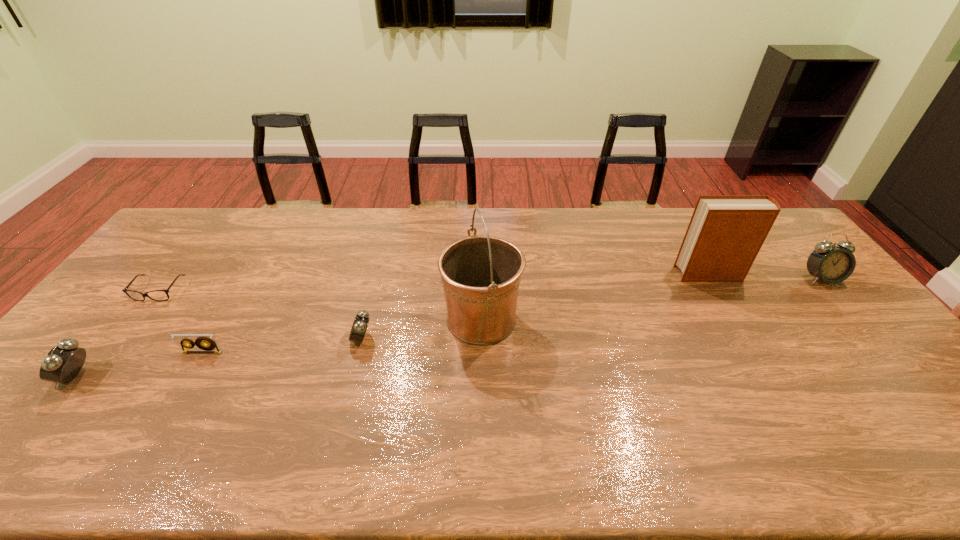
At what (x,y) coordinates should I click in order to perform the action: click on free region located 0.340m on the open cover of the sixth shortest object. Please return your answer as a coordinate pair (x, y). The height and width of the screenshot is (540, 960). Looking at the image, I should click on (571, 274).

This screenshot has width=960, height=540. I want to click on free space located on the open cover of the sixth shortest object, so click(x=618, y=274).

Image resolution: width=960 pixels, height=540 pixels. What are the coordinates of `vacant area situated on the front-facing side of the spectacles` in the screenshot? It's located at (129, 329).

Find the location of a particular element. alarm clock that is at the left edge is located at coordinates (62, 364).

At what (x,y) coordinates should I click in order to perform the action: click on spectacles that is at the left edge. Please return your answer as a coordinate pair (x, y). Looking at the image, I should click on (125, 290).

The width and height of the screenshot is (960, 540). Find the location of `object at the right edge`. object at the right edge is located at coordinates (832, 264).

Locate an element on the screen. The height and width of the screenshot is (540, 960). free region at the far edge of the desktop is located at coordinates (670, 243).

Where is `vacant space at the near edge of the desktop`? vacant space at the near edge of the desktop is located at coordinates [800, 413].

Identify the location of vacant point at the left edge. This screenshot has height=540, width=960. (131, 326).

This screenshot has height=540, width=960. What are the coordinates of `vacant space at the right edge of the desktop` in the screenshot? It's located at (879, 336).